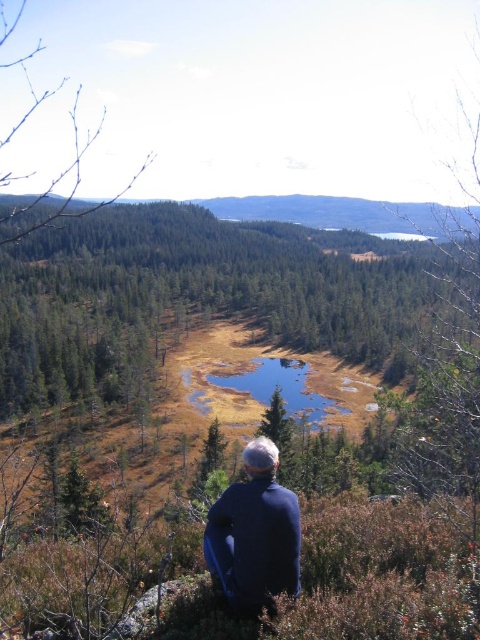
Question: Can you confirm if blue fleece jacket at lower center is smaller than clear water at center?

Choices:
 (A) yes
 (B) no

Answer: (A)

Question: Which of the following is the closest to the observer?

Choices:
 (A) blue fleece jacket at lower center
 (B) clear water at center

Answer: (A)

Question: Does blue fleece jacket at lower center appear on the left side of clear water at center?

Choices:
 (A) no
 (B) yes

Answer: (B)

Question: Can you confirm if blue fleece jacket at lower center is bigger than clear water at center?

Choices:
 (A) no
 (B) yes

Answer: (A)

Question: Which point appears closest to the camera in this image?

Choices:
 (A) coord(215,547)
 (B) coord(239,385)

Answer: (A)

Question: Among these points, which one is nearest to the camera?

Choices:
 (A) (295, 522)
 (B) (227, 378)

Answer: (A)